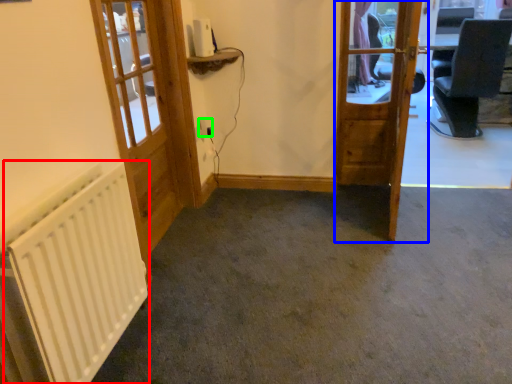
Question: Estimate the real-world distances between objects in this image. Which object is closer to radiator (highlighted by a red box), door (highlighted by a blue box) or electric outlet (highlighted by a green box)?

Choices:
 (A) door
 (B) electric outlet

Answer: (A)